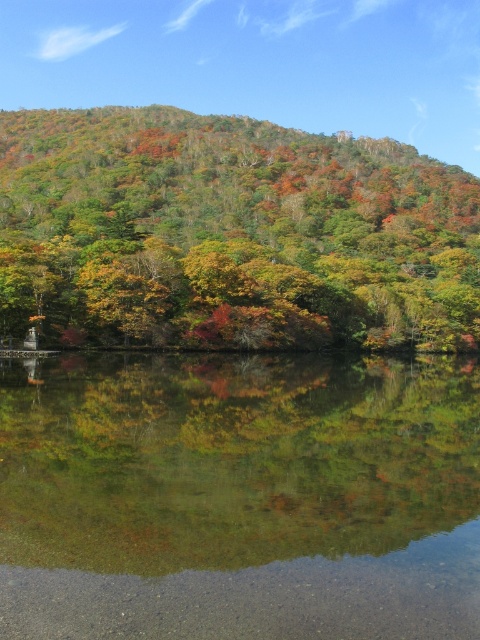
Can you confirm if clear glass water at center is taller than multicolored foliage at center?

No.

This screenshot has width=480, height=640. What do you see at coordinates (240, 497) in the screenshot?
I see `clear glass water at center` at bounding box center [240, 497].

Is point (149, 435) less distant than point (182, 301)?

Yes, it is in front of point (182, 301).

Identify the location of clear glass water at center. (240, 497).